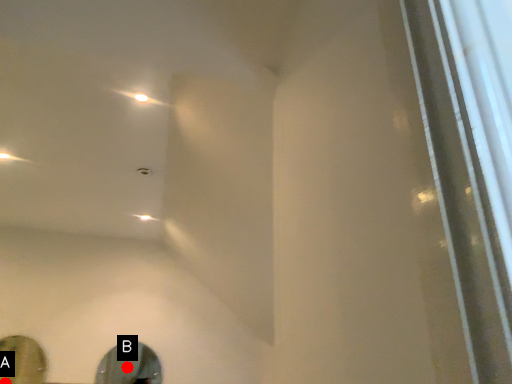
Question: Two points are circled on the image, labeled by A and B beside each circle. Which point is closer to the camera?

Choices:
 (A) A is closer
 (B) B is closer

Answer: (A)